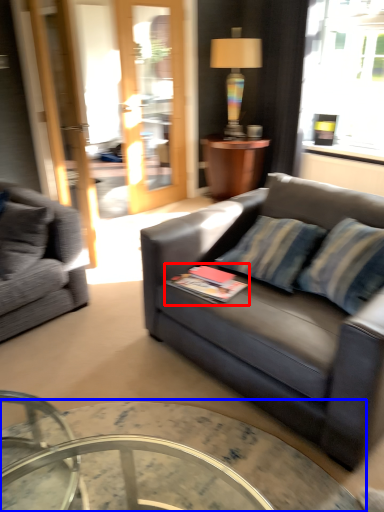
Question: Which of the following is the closest to the observer, book (highlighted by a red box) or coffee table (highlighted by a blue box)?

Choices:
 (A) book
 (B) coffee table

Answer: (B)